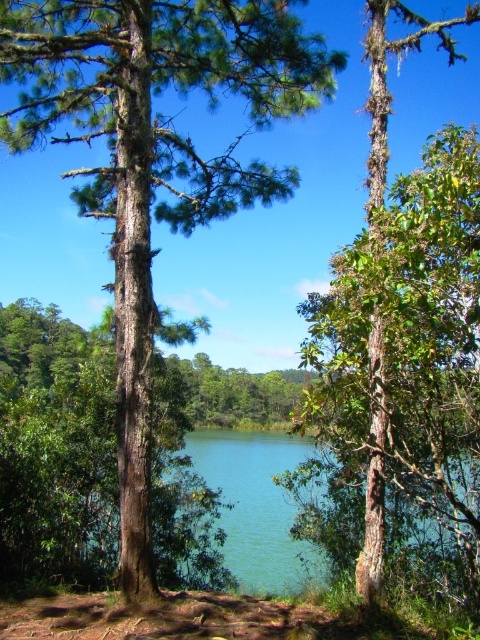
Question: From the image, what is the correct spatial relationship of brown rough tree at center in relation to green rough bark tree at center?

Choices:
 (A) right
 (B) left

Answer: (B)

Question: Which point is closer to the camera?

Choices:
 (A) (97, 1)
 (B) (478, 166)

Answer: (B)

Question: Considering the relative positions of brown rough tree at center and green rough bark tree at center in the image provided, where is brown rough tree at center located with respect to green rough bark tree at center?

Choices:
 (A) above
 (B) below

Answer: (A)

Question: Among these objects, which one is nearest to the camera?

Choices:
 (A) brown rough tree at center
 (B) green rough bark tree at center

Answer: (B)

Question: Is brown rough tree at center positioned in front of green rough bark tree at center?

Choices:
 (A) yes
 (B) no

Answer: (B)